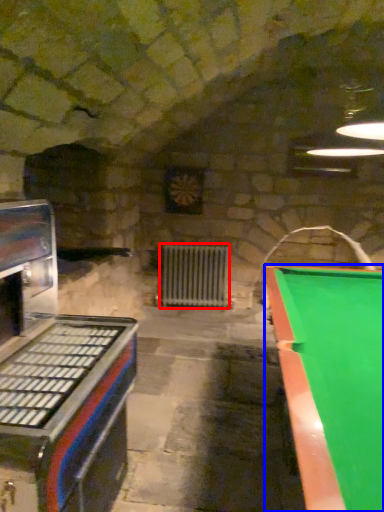
Question: Which point is further to the camera, radiator (highlighted by a red box) or billiard table (highlighted by a blue box)?

Choices:
 (A) radiator
 (B) billiard table

Answer: (A)